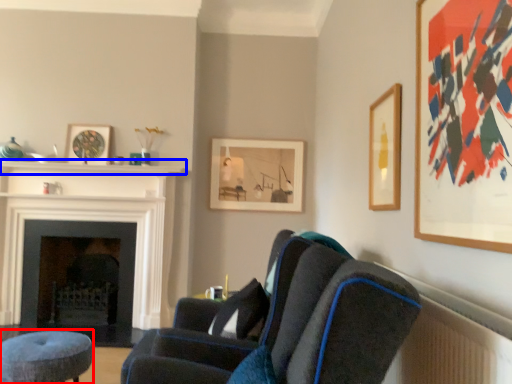
Question: Which object appears farthest to the camera in this image, stool (highlighted by a red box) or balustrade (highlighted by a blue box)?

Choices:
 (A) stool
 (B) balustrade

Answer: (B)